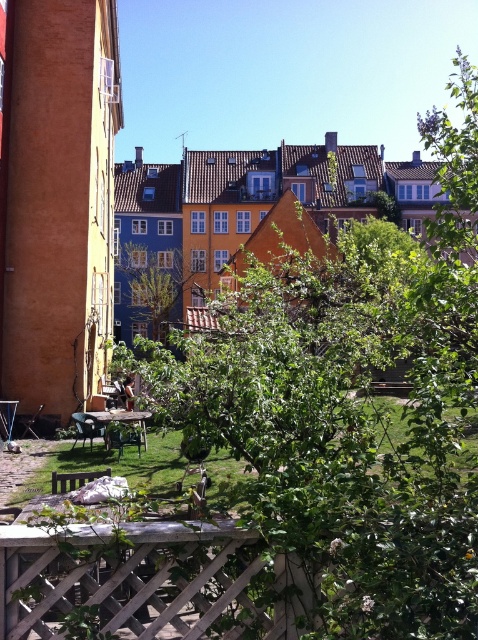
You are standing in the urban scene and want to take a photo of the green leafy tree at center. To get the best shot, you need to position yourself so that the wooden lattice at lower center is partially framing the tree. Based on their positions, which side of the tree should you stand on to achieve this effect?

Since the wooden lattice at lower center is to the right of the green leafy tree at center, you should stand to the left side of the tree to have the lattice frame it from the right side.